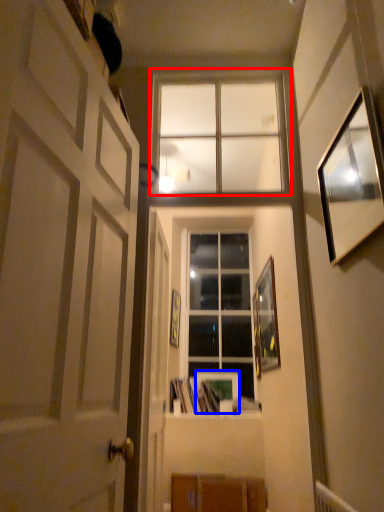
Question: Which object is closer to the camera taking this photo, window (highlighted by a red box) or picture frame (highlighted by a blue box)?

Choices:
 (A) window
 (B) picture frame

Answer: (A)